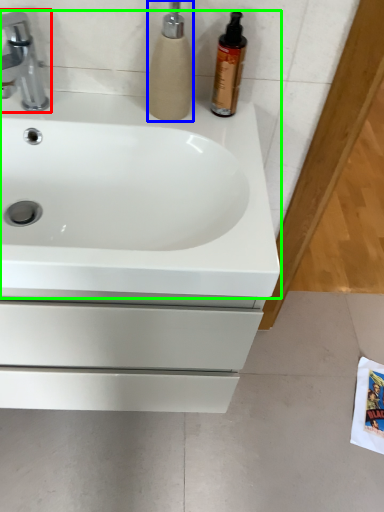
Question: Which is nearer to the tap (highlighted by a red box)? soap dispenser (highlighted by a blue box) or sink (highlighted by a green box).

Choices:
 (A) soap dispenser
 (B) sink

Answer: (A)